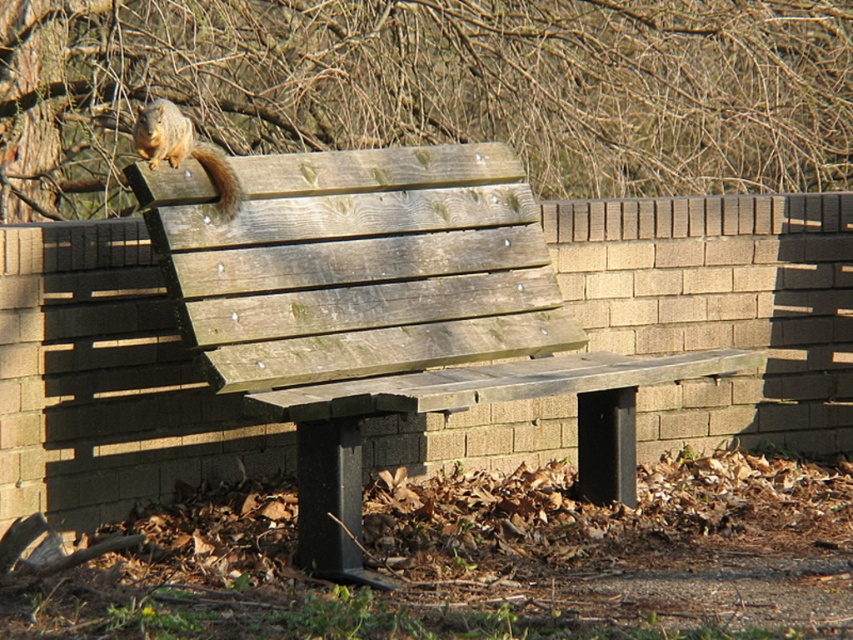
Which is more to the left, brown wood tree at upper center or weathered wood bench at center?

Positioned to the left is weathered wood bench at center.

Does brown wood tree at upper center appear on the left side of weathered wood bench at center?

Incorrect, brown wood tree at upper center is not on the left side of weathered wood bench at center.

Between point (142, 100) and point (521, 244), which one is positioned in front?

Point (521, 244) is more forward.

The height and width of the screenshot is (640, 853). What are the coordinates of `brown wood tree at upper center` in the screenshot? It's located at click(x=433, y=88).